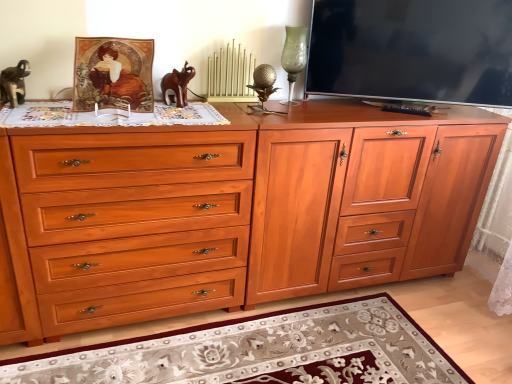
Question: Can we say matte black tv at upper right lies outside brown wooden elephant at center?

Choices:
 (A) no
 (B) yes

Answer: (B)

Question: From the image's perspective, is matte black tv at upper right under brown wooden elephant at center?

Choices:
 (A) yes
 (B) no

Answer: (B)

Question: Is matte black tv at upper right oriented away from brown wooden elephant at center?

Choices:
 (A) no
 (B) yes

Answer: (A)

Question: Are matte black tv at upper right and brown wooden elephant at center located far from each other?

Choices:
 (A) no
 (B) yes

Answer: (A)

Question: Can you confirm if matte black tv at upper right is smaller than brown wooden elephant at center?

Choices:
 (A) yes
 (B) no

Answer: (B)

Question: Is brown wooden elephant at center wider or thinner than gold textured golf ball at center?

Choices:
 (A) wide
 (B) thin

Answer: (A)

Question: From the image's perspective, relative to gold textured golf ball at center, is brown wooden elephant at center above or below?

Choices:
 (A) below
 (B) above

Answer: (B)

Question: Visually, is brown wooden elephant at center positioned to the left or to the right of gold textured golf ball at center?

Choices:
 (A) right
 (B) left

Answer: (B)

Question: From a real-world perspective, is brown wooden elephant at center above or below gold textured golf ball at center?

Choices:
 (A) below
 (B) above

Answer: (A)

Question: From the image's perspective, is gold textured golf ball at center located above or below matte black tv at upper right?

Choices:
 (A) below
 (B) above

Answer: (A)

Question: From a real-world perspective, is gold textured golf ball at center physically located above or below matte black tv at upper right?

Choices:
 (A) below
 (B) above

Answer: (A)

Question: Visually, is gold textured golf ball at center positioned to the left or to the right of matte black tv at upper right?

Choices:
 (A) right
 (B) left

Answer: (B)

Question: Do you think gold textured golf ball at center is within matte black tv at upper right, or outside of it?

Choices:
 (A) outside
 (B) inside

Answer: (A)

Question: Is matte wood file cabinet at center situated inside green glass vase at upper center or outside?

Choices:
 (A) inside
 (B) outside

Answer: (B)

Question: In terms of size, does matte wood file cabinet at center appear bigger or smaller than green glass vase at upper center?

Choices:
 (A) big
 (B) small

Answer: (A)